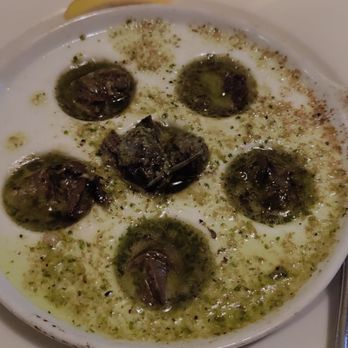
Where is `white tray`? white tray is located at coordinates (22, 27), (285, 310).